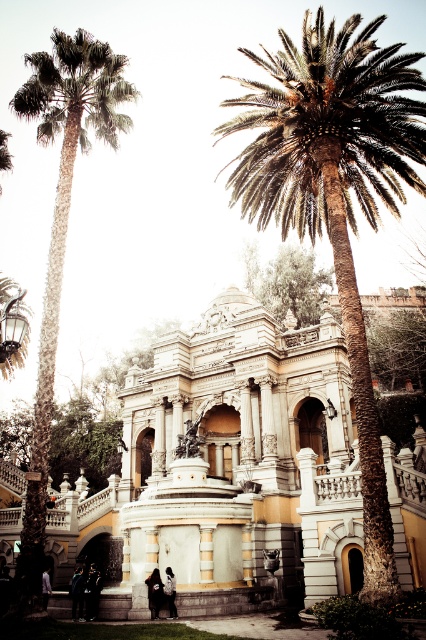
Question: Is yellow stone palace at center bigger than dark blue jeans at lower left?

Choices:
 (A) no
 (B) yes

Answer: (B)

Question: Which point is farther to the camera?

Choices:
 (A) coord(270,273)
 (B) coord(80,64)
 (C) coord(344,156)

Answer: (A)

Question: Among these points, which one is farthest from the camera?

Choices:
 (A) (299, 481)
 (B) (370, 131)
 (C) (173, 600)

Answer: (A)

Question: Does green leafy palm at center appear over green leafy tree at upper center?

Choices:
 (A) no
 (B) yes

Answer: (B)

Question: Which of the following is the farthest from the observer?

Choices:
 (A) dark gray fabric jacket at lower center
 (B) green leafy palm at center
 (C) dark blue jeans at lower center
 (D) green leafy tree at upper center

Answer: (D)

Question: Can you confirm if yellow stone palace at center is wider than green leafy tree at upper center?

Choices:
 (A) yes
 (B) no

Answer: (A)